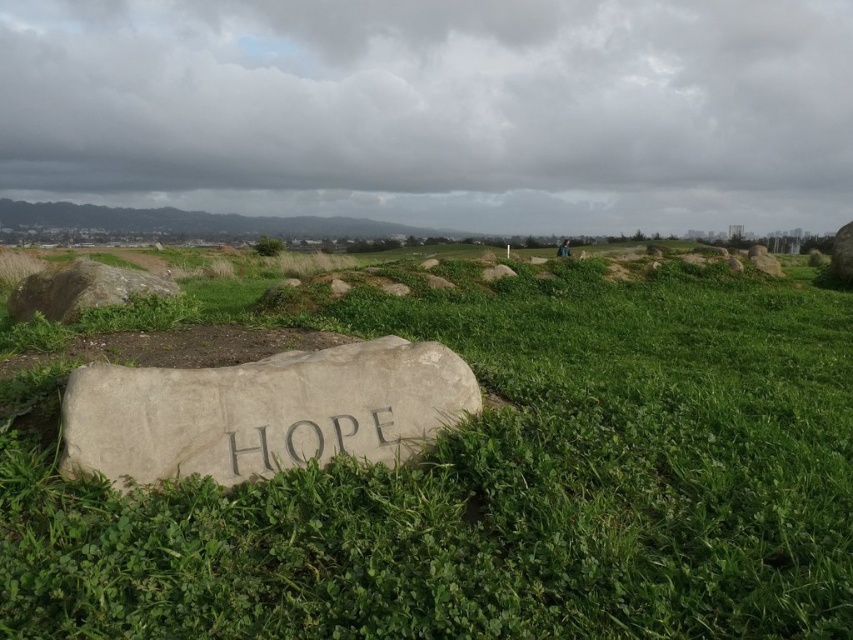
Question: Is green grassy at center to the right of gray stone engraving at center from the viewer's perspective?

Choices:
 (A) yes
 (B) no

Answer: (A)

Question: Based on their relative distances, which object is nearer to the gray stone at center?

Choices:
 (A) green grassy at center
 (B) gray stone at upper left

Answer: (A)

Question: Can you confirm if green grassy at center is positioned to the right of gray stone at center?

Choices:
 (A) yes
 (B) no

Answer: (A)

Question: Which point is closer to the camera taking this photo?

Choices:
 (A) (41, 275)
 (B) (73, 420)

Answer: (B)

Question: Does gray stone at center appear under gray stone at upper left?

Choices:
 (A) yes
 (B) no

Answer: (A)

Question: Which point appears closest to the camera in this image?

Choices:
 (A) (310, 435)
 (B) (93, 547)

Answer: (B)